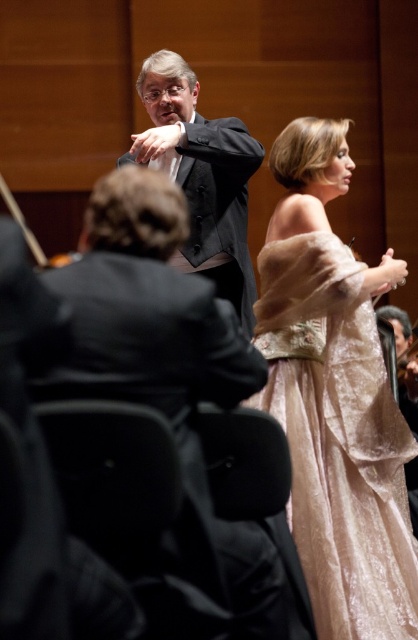
Based on the photo, you are a photographer trying to capture a clear shot of the conductor in the classical music performance. You notice two conductors wearing a matte black suit at center and a dark gray suit at center. Which conductor is closer to the camera?

The matte black suit at center is closer to the camera because it is in front of the dark gray suit at center.

You are an audience member sitting in the front row of the concert hall. You notice a point marked at coordinates (334, 397) in the image. What object is located at this point?

The point at coordinates (334, 397) indicates the velvet beige gown at center.